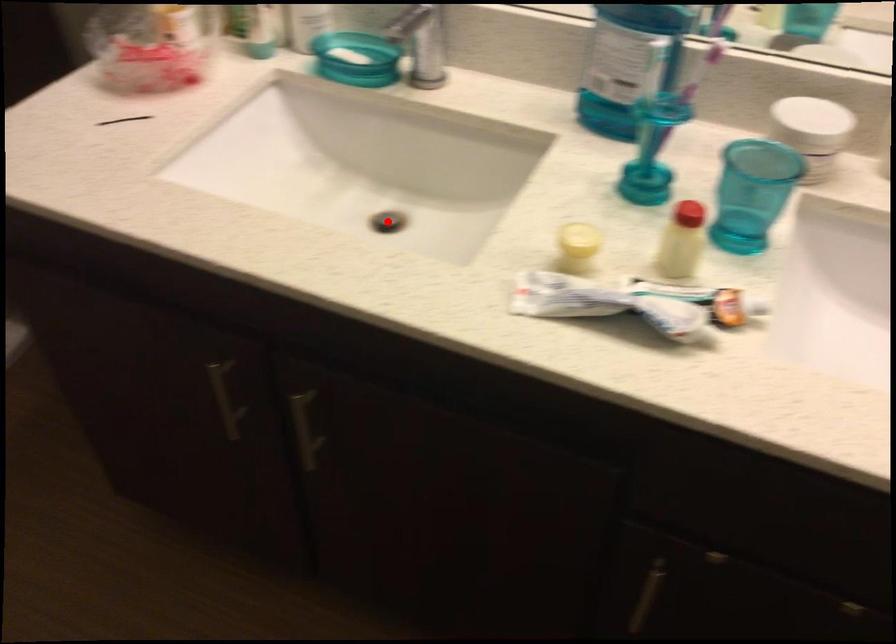
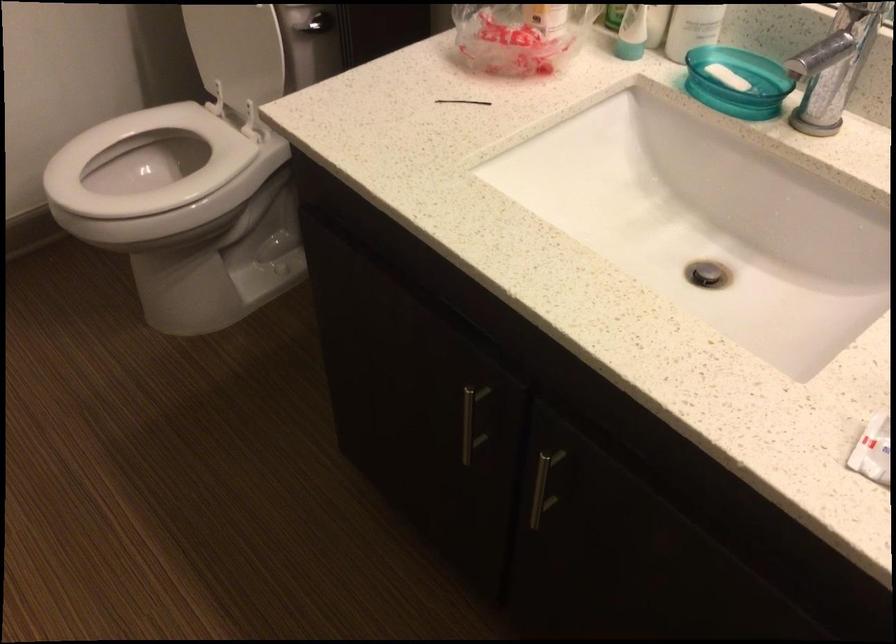
The point at the highlighted location is marked in the first image. Where is the corresponding point in the second image?

(707, 274)